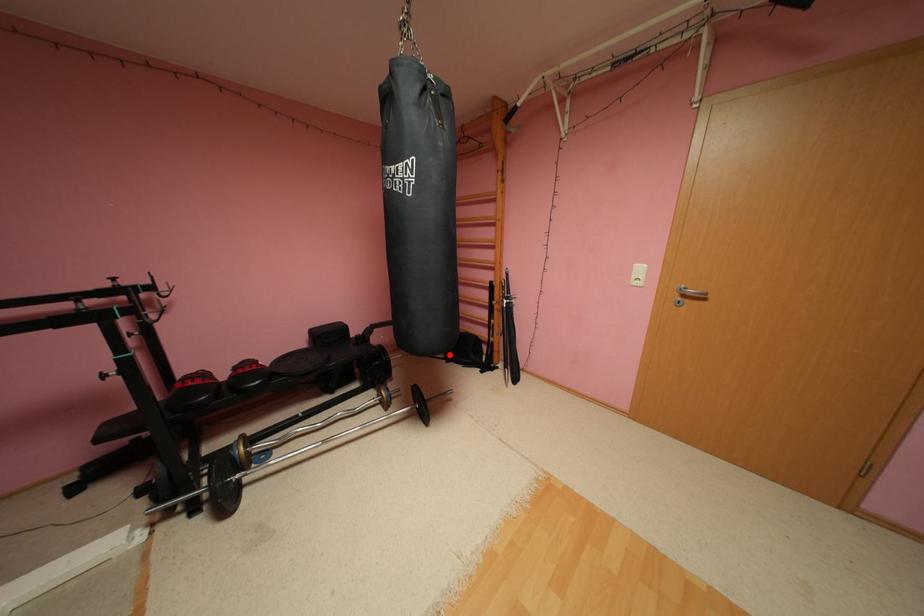
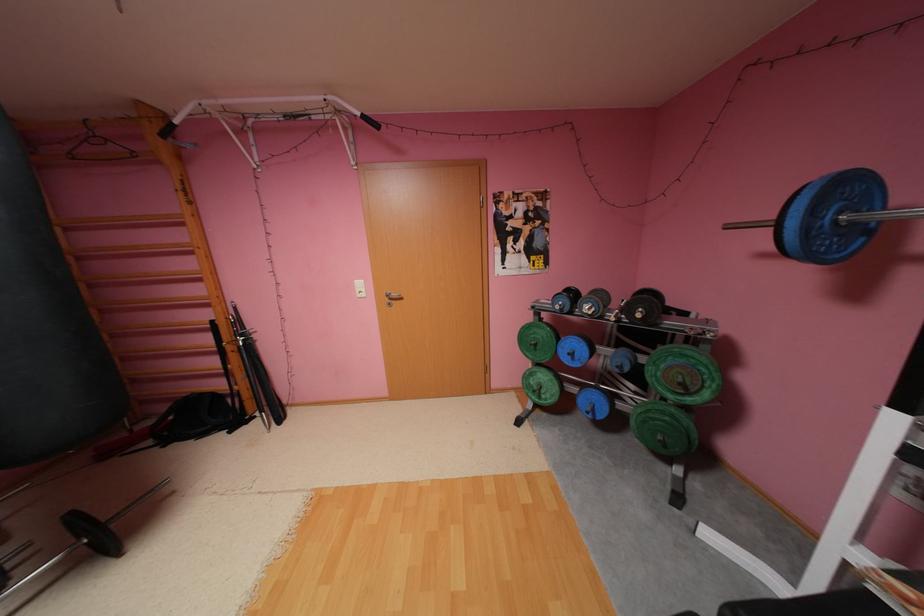
Find the pixel in the second image that matches the highlighted location in the first image.

(157, 442)